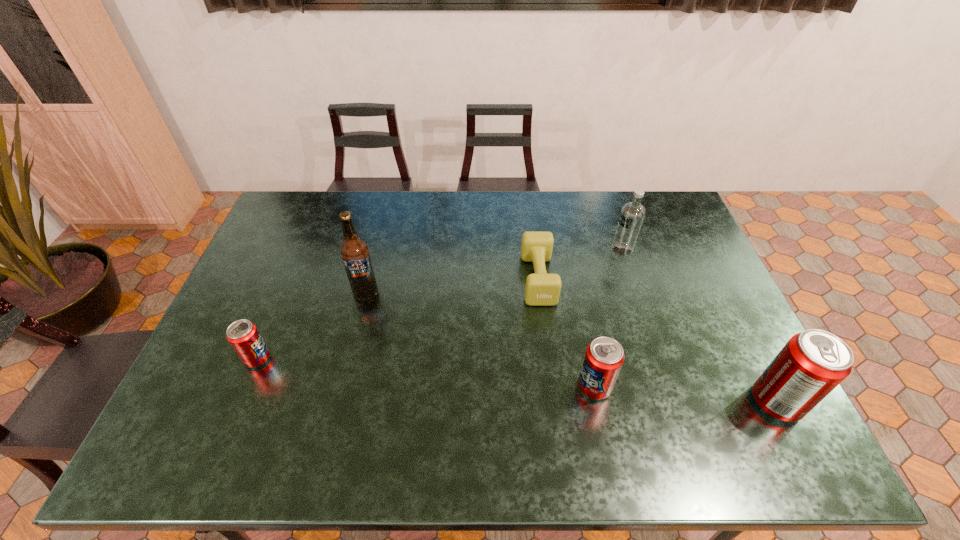
The width and height of the screenshot is (960, 540). Find the location of `dumbbell`. dumbbell is located at coordinates (542, 289).

Image resolution: width=960 pixels, height=540 pixels. In order to click on vacant space located 0.150m on the back of the leftmost soda can in this screenshot , I will do `click(279, 306)`.

The height and width of the screenshot is (540, 960). Find the location of `vacant space positioned on the left of the second soda can from right to left`. vacant space positioned on the left of the second soda can from right to left is located at coordinates (431, 387).

This screenshot has width=960, height=540. Find the location of `vacant area situated on the left of the rightmost soda can`. vacant area situated on the left of the rightmost soda can is located at coordinates (679, 402).

At what (x,y) coordinates should I click in order to perform the action: click on free space located on the front label of the second object from right to left. Please return your answer as a coordinate pair (x, y). Looking at the image, I should click on (585, 249).

The image size is (960, 540). I want to click on free region located 0.170m on the front label of the second object from right to left, so click(x=561, y=249).

Identify the location of vacant area situated on the front label of the second object from right to left. Image resolution: width=960 pixels, height=540 pixels. (596, 249).

I want to click on free spot located on the label of the beer bottle, so click(x=337, y=406).

Image resolution: width=960 pixels, height=540 pixels. What are the coordinates of `free spot located on the back of the shortest object` in the screenshot? It's located at (534, 244).

Locate an element on the screen. object that is at the left edge is located at coordinates (244, 337).